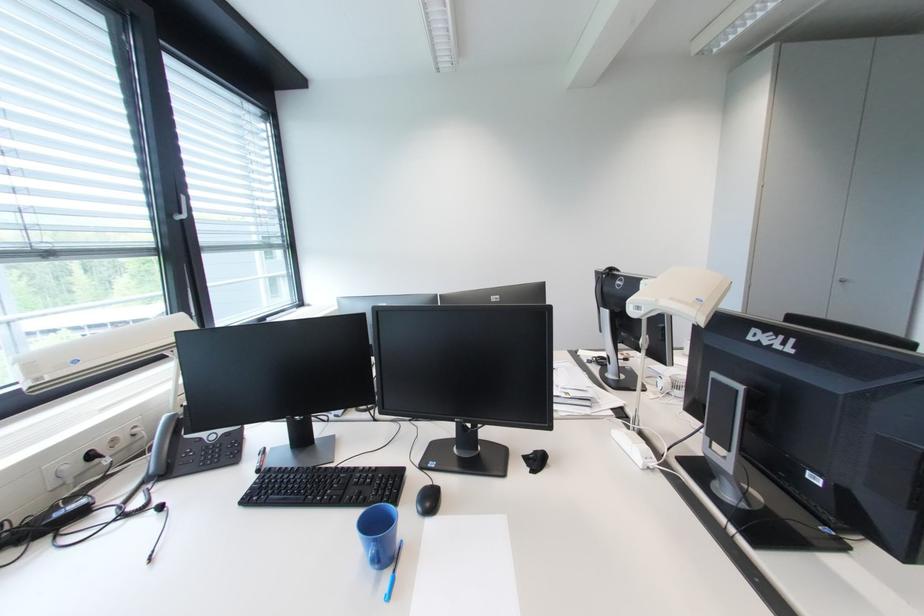
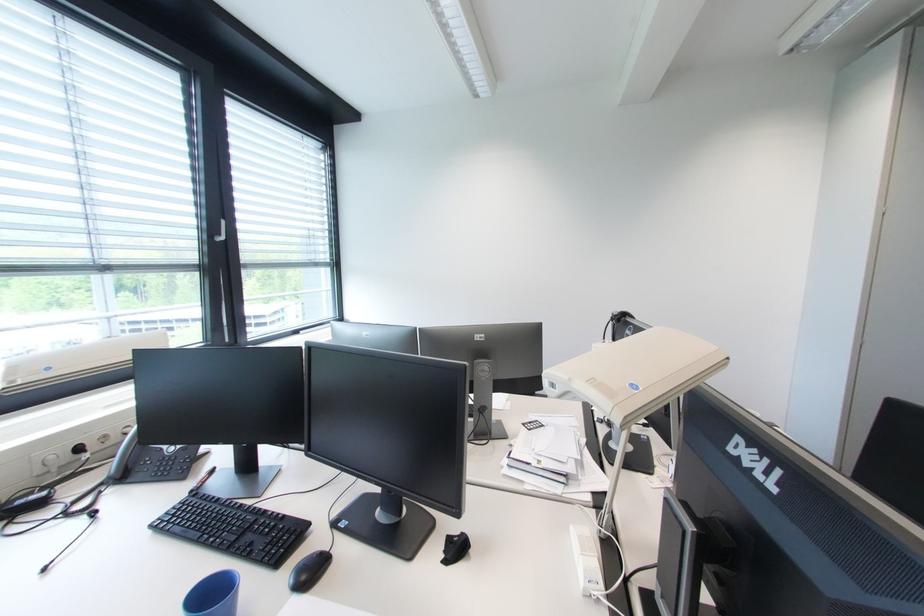
The point at [383,469] is marked in the first image. Where is the corresponding point in the second image?

(290, 517)